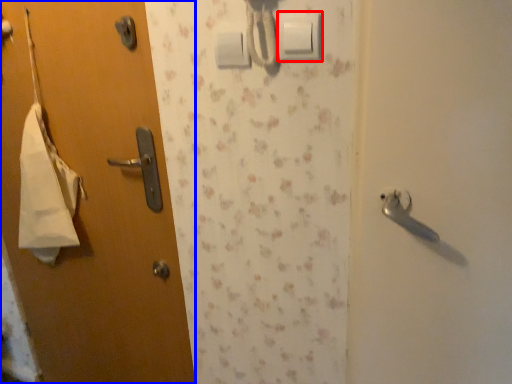
Question: Which object appears closest to the camera in this image, light switch (highlighted by a red box) or door (highlighted by a blue box)?

Choices:
 (A) light switch
 (B) door

Answer: (A)